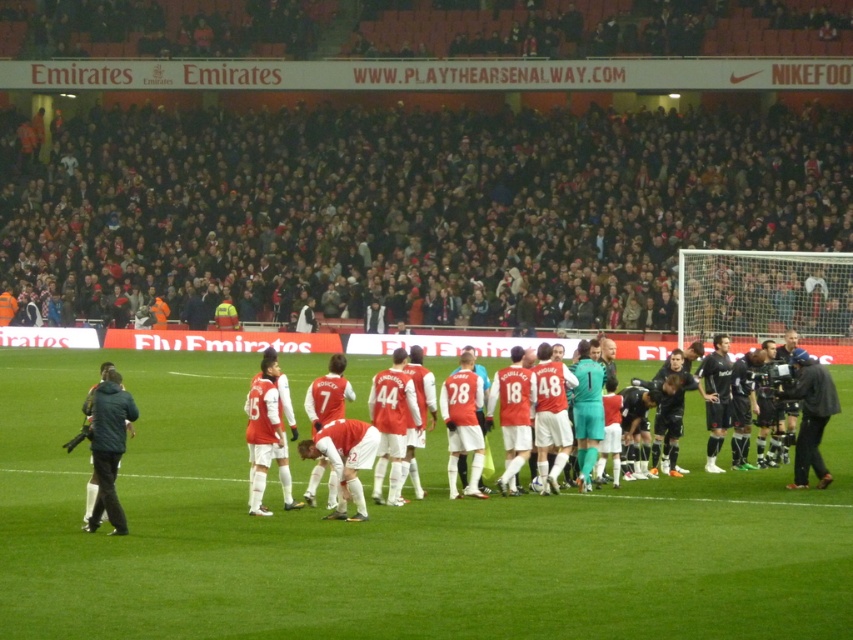
What do you see at coordinates (389, 532) in the screenshot? I see `green grass field at center` at bounding box center [389, 532].

Between green grass field at center and red matte jersey at center, which one appears on the right side from the viewer's perspective?

red matte jersey at center is more to the right.

From the picture: Who is more distant from viewer, [128,500] or [314,339]?

Point [314,339]

Identify the location of green grass field at center. The image size is (853, 640). (389, 532).

Between point (184, 589) and point (805, 365), which one is positioned in front?

Point (184, 589) is in front.

Which is more to the left, green grass field at center or black leather jacket at right?

green grass field at center

Does point (834, 492) lie behind point (808, 376)?

No, (834, 492) is closer to viewer.

Where is `green grass field at center`? green grass field at center is located at coordinates (389, 532).

Between point (842, 504) and point (107, 401), which one is positioned behind?

The point (842, 504) is behind.

Who is lower down, green grass field at center or dark green jacket at left?

green grass field at center is below.

Find the location of a particular element. The width and height of the screenshot is (853, 640). green grass field at center is located at coordinates (389, 532).